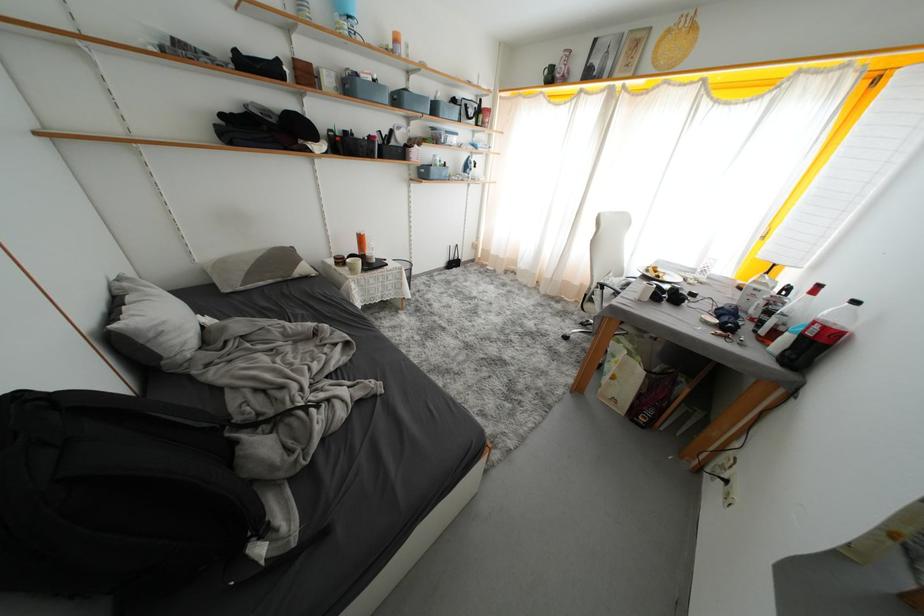
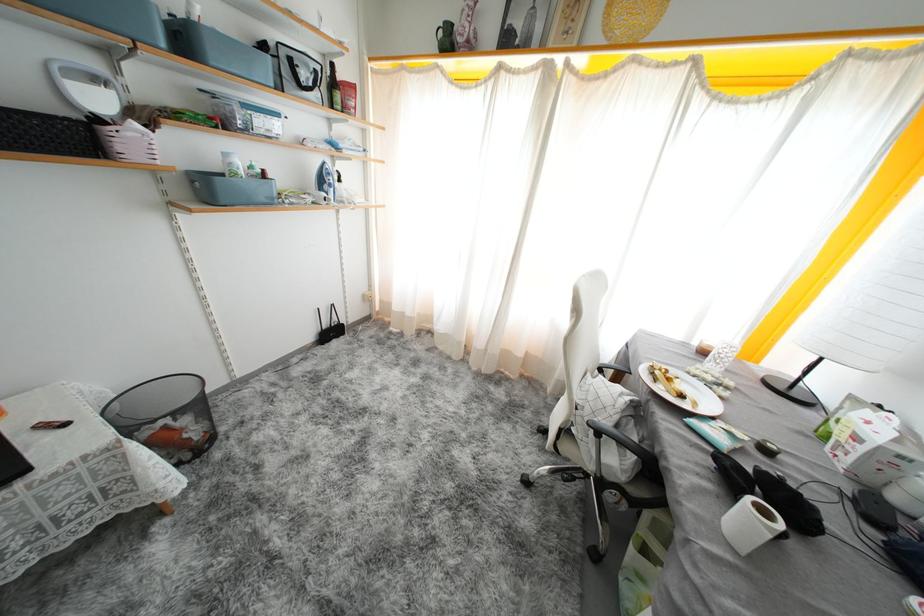
In the second image, find the point that corresponds to (x=431, y=177) in the first image.

(215, 196)